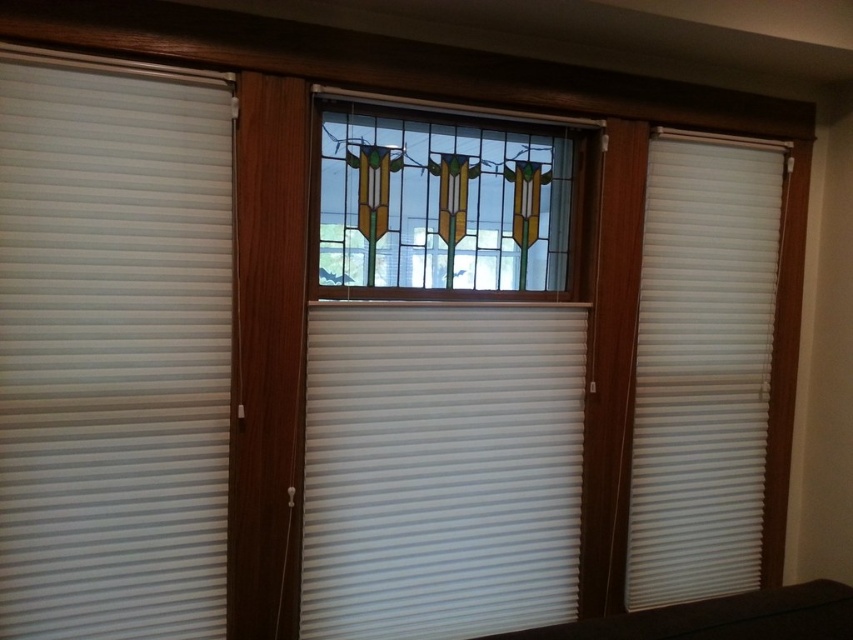
You are standing in the room and want to reach the point at coordinates point (520, 560). If you can move 10 feet in one minute, how long will it take you to reach the point?

The point (520, 560) is 8.04 feet away from you, so it will take approximately 0.804 minutes to reach it since you can move 10 feet per minute.

You are standing in the room and want to open the white matte blinds at left and the white matte blind at right to let in more light. Which one should you adjust first if you want to start with the one closer to the ceiling?

The white matte blinds at left should be adjusted first because they are located above the white matte blind at right, making them closer to the ceiling.